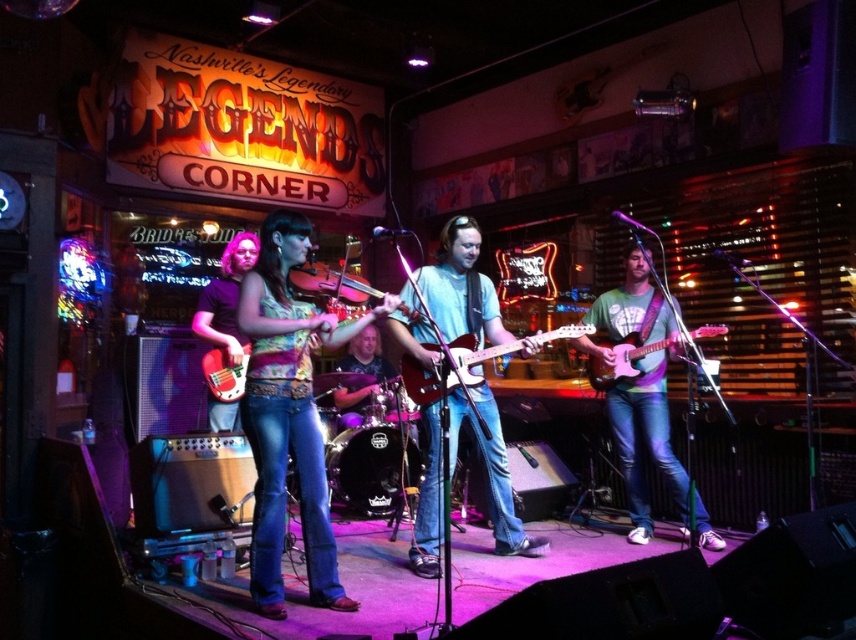
Question: Is multicolored fabric top at center wider than matte red guitar at center?

Choices:
 (A) yes
 (B) no

Answer: (A)

Question: Does multicolored fabric top at center appear on the right side of pink glossy electric guitar at right?

Choices:
 (A) no
 (B) yes

Answer: (A)

Question: Estimate the real-world distances between objects in this image. Which object is closer to the multicolored fabric top at center?

Choices:
 (A) brushed metal guitar at center
 (B) pink glossy electric guitar at right

Answer: (A)

Question: Does wooden acoustic guitar at center appear under matte red guitar at center?

Choices:
 (A) no
 (B) yes

Answer: (B)

Question: Which point is closer to the camera taking this photo?

Choices:
 (A) (613, 420)
 (B) (452, 385)
 (C) (317, 445)
 (D) (214, 369)

Answer: (C)

Question: Which point is farther from the camera taking this photo?

Choices:
 (A) (244, 360)
 (B) (299, 369)
 (C) (212, 406)
 (D) (635, 499)

Answer: (D)